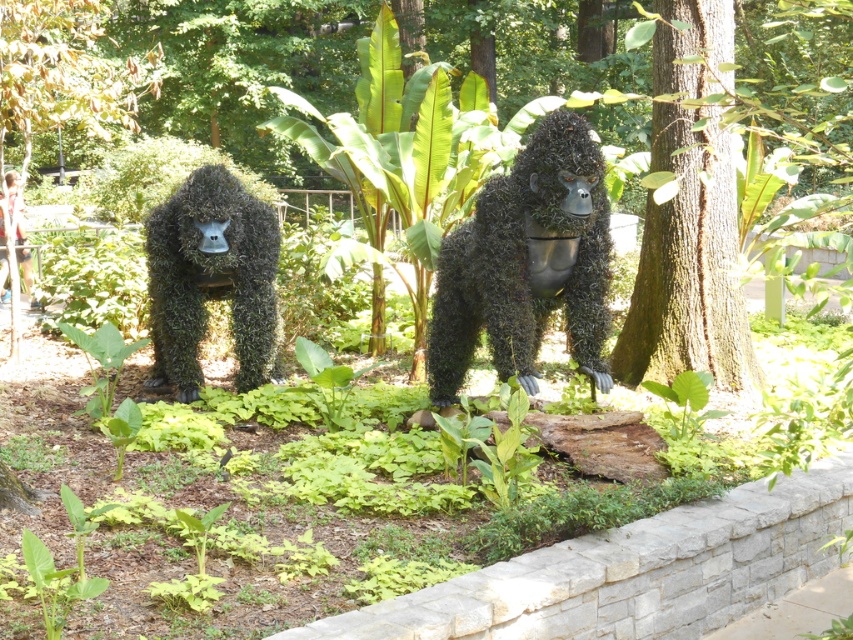
Question: Which object appears farthest from the camera in this image?

Choices:
 (A) green mossy gorilla at left
 (B) green rough bark tree at center

Answer: (A)

Question: Does green mossy gorilla at center appear on the left side of green mossy gorilla at left?

Choices:
 (A) yes
 (B) no

Answer: (B)

Question: Does green mossy gorilla at center have a smaller size compared to green mossy gorilla at left?

Choices:
 (A) yes
 (B) no

Answer: (B)

Question: Estimate the real-world distances between objects in this image. Which object is closer to the green rough bark tree at center?

Choices:
 (A) green mossy gorilla at center
 (B) green mossy gorilla at left

Answer: (A)

Question: Which of the following is the closest to the observer?

Choices:
 (A) (650, 324)
 (B) (111, 115)

Answer: (A)

Question: Is green mossy gorilla at left thinner than green leafy tree at upper left?

Choices:
 (A) yes
 (B) no

Answer: (A)